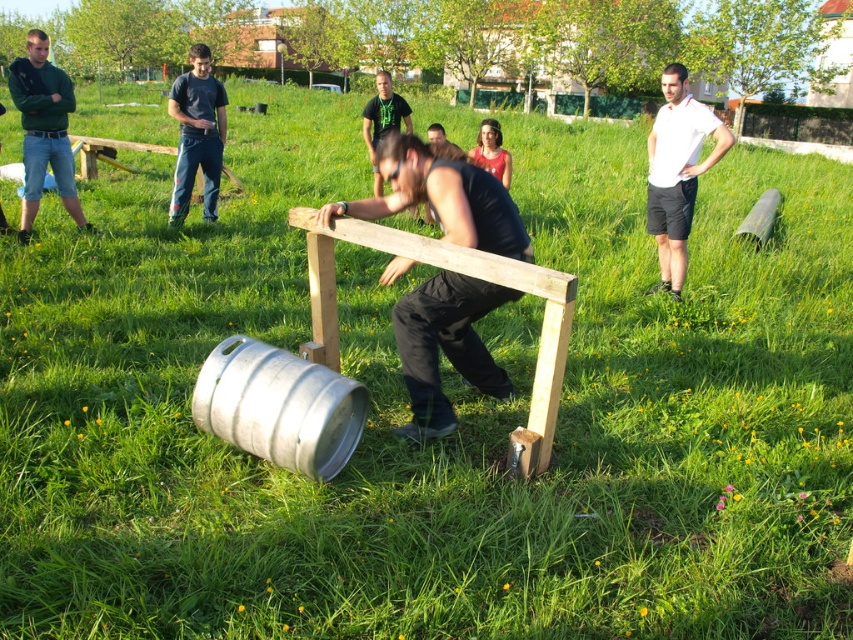
Question: Estimate the real-world distances between objects in this image. Which object is farther from the green fabric shirt at center?

Choices:
 (A) green matte shirt at upper left
 (B) silver metallic barrel at lower left
 (C) white cotton shirt at upper right

Answer: (B)

Question: Is silver metallic barrel at lower left further to the viewer compared to green matte shirt at upper left?

Choices:
 (A) yes
 (B) no

Answer: (B)

Question: Which object is farther from the camera taking this photo?

Choices:
 (A) metallic silver squat at center
 (B) brushed metal shirt at upper left
 (C) green fabric shirt at center
 (D) white cotton shirt at upper right

Answer: (B)

Question: Is green matte shirt at upper left above green fabric shirt at center?

Choices:
 (A) no
 (B) yes

Answer: (A)

Question: Does silver metallic barrel at lower left come behind green matte shirt at upper left?

Choices:
 (A) no
 (B) yes

Answer: (A)

Question: Estimate the real-world distances between objects in this image. Which object is closer to the metallic silver squat at center?

Choices:
 (A) green matte shirt at upper left
 (B) brushed metal shirt at upper left
 (C) green fabric shirt at center

Answer: (C)